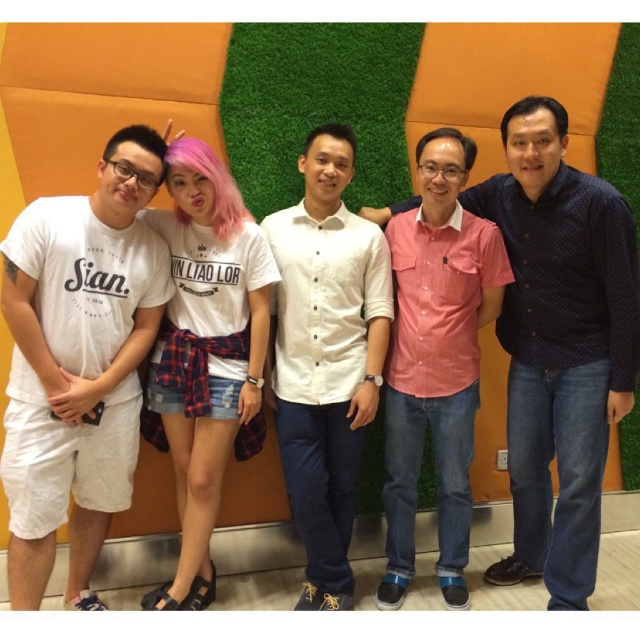
Question: Is white cotton t-shirt at center below black matte hair at center?

Choices:
 (A) no
 (B) yes

Answer: (B)

Question: Is black matte hair at upper right closer to camera compared to black matte hair at center?

Choices:
 (A) yes
 (B) no

Answer: (A)

Question: Does blue dotted shirt at center appear on the right side of black matte hair at upper right?

Choices:
 (A) no
 (B) yes

Answer: (A)

Question: Which point is closer to the camera taking this photo?

Choices:
 (A) (152, 218)
 (B) (160, 141)

Answer: (B)

Question: Which object appears farthest from the camera in this image?

Choices:
 (A) white cotton t-shirt at left
 (B) white cotton shirt at center
 (C) black matte hair at upper right
 (D) black matte hair at center

Answer: (D)

Question: Which of the following is the farthest from the observer?

Choices:
 (A) white cotton t-shirt at left
 (B) white cotton t-shirt at center
 (C) black matte hair at upper right

Answer: (C)